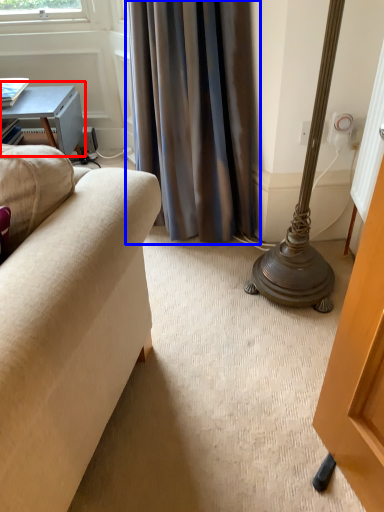
Question: Which of the following is the closest to the observer, table (highlighted by a red box) or curtain (highlighted by a blue box)?

Choices:
 (A) table
 (B) curtain

Answer: (B)